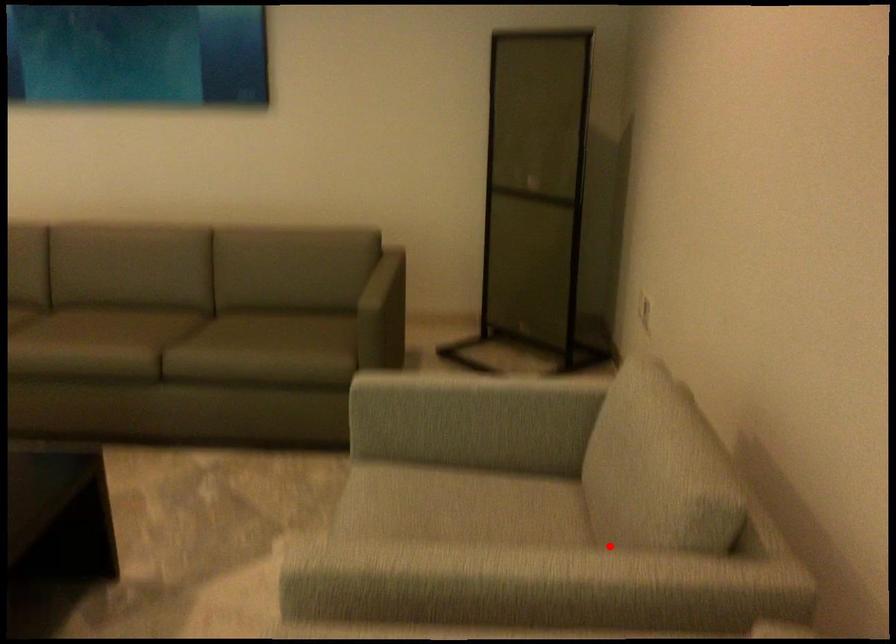
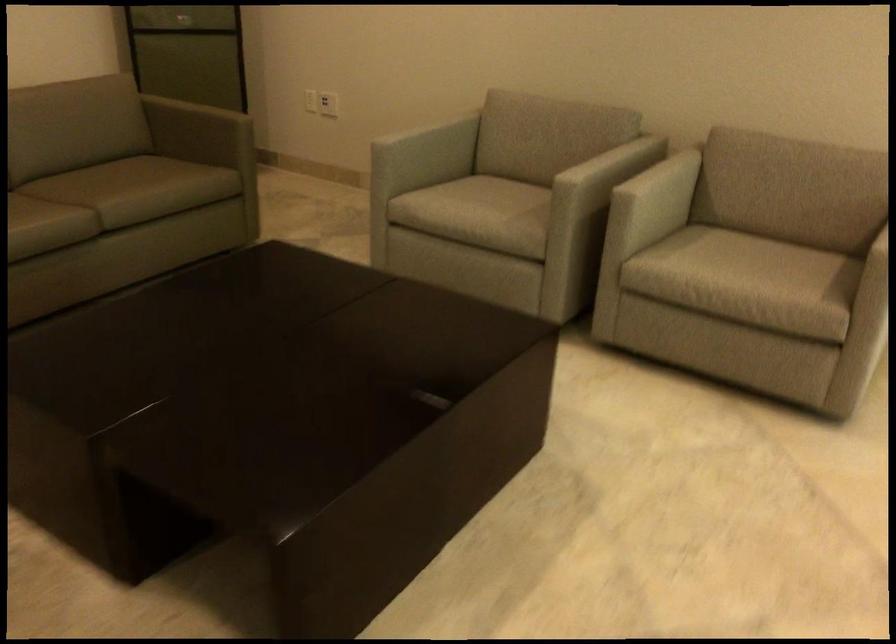
The point at the highlighted location is marked in the first image. Where is the corresponding point in the second image?

(588, 149)